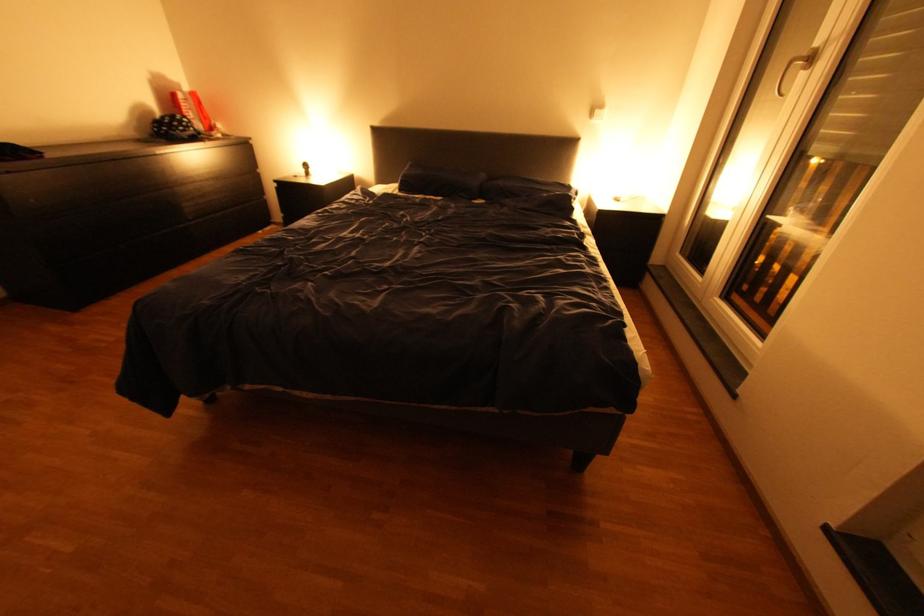
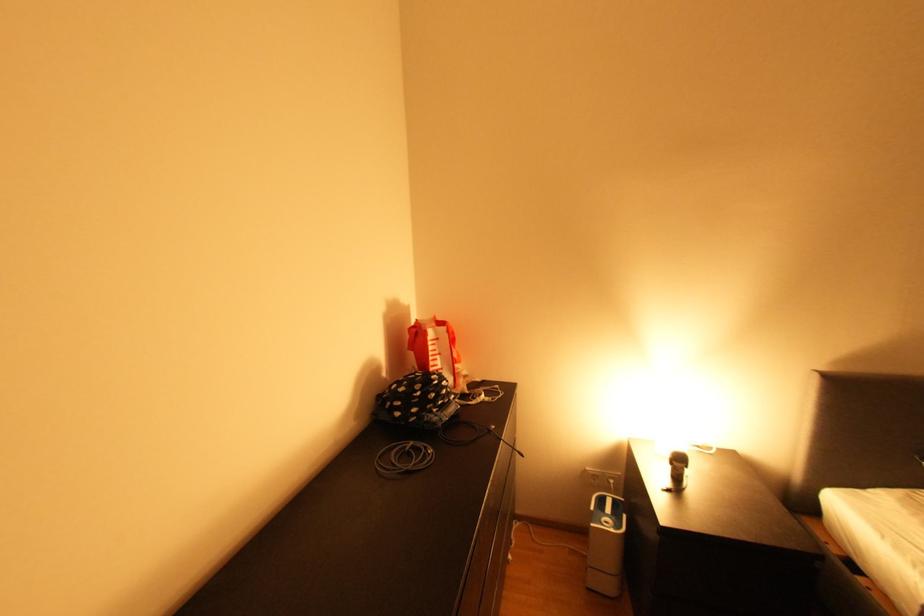
Locate, in the second image, the point that corresponds to pixel 185 131 in the first image.

(441, 411)